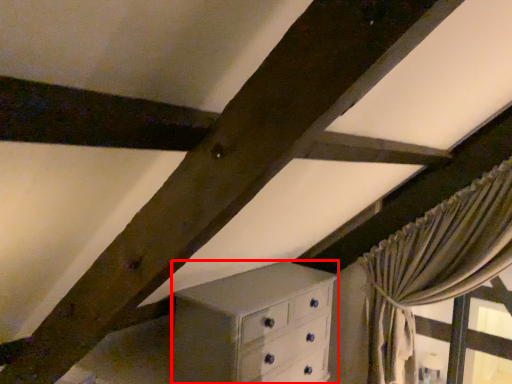
Question: From the image's perspective, what is the correct spatial relationship of chest of drawers (annotated by the red box) in relation to curtain?

Choices:
 (A) above
 (B) below

Answer: (B)